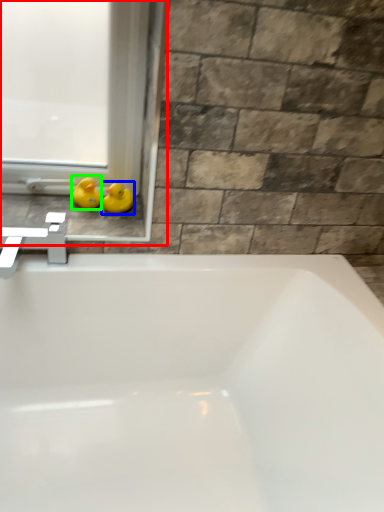
Question: Estimate the real-world distances between objects in this image. Which object is closer to window frame (highlighted by a red box), duck (highlighted by a blue box) or duck (highlighted by a green box)?

Choices:
 (A) duck
 (B) duck

Answer: (B)